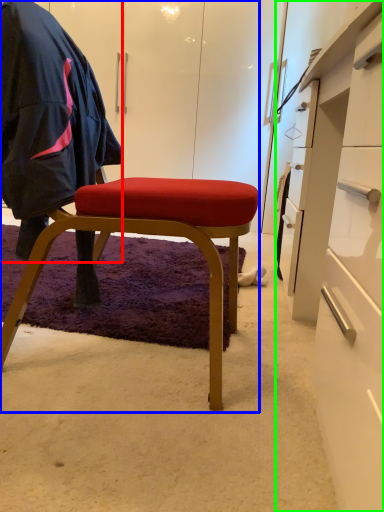
Question: Which object is positioned farthest from clothing (highlighted by a red box)? Select from chair (highlighted by a blue box) and desk (highlighted by a green box).

Choices:
 (A) chair
 (B) desk

Answer: (B)